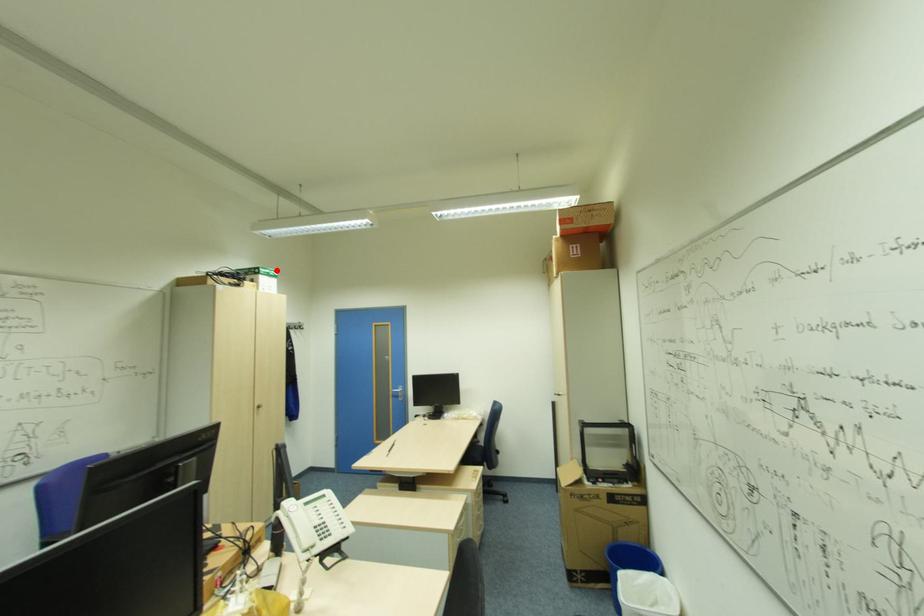
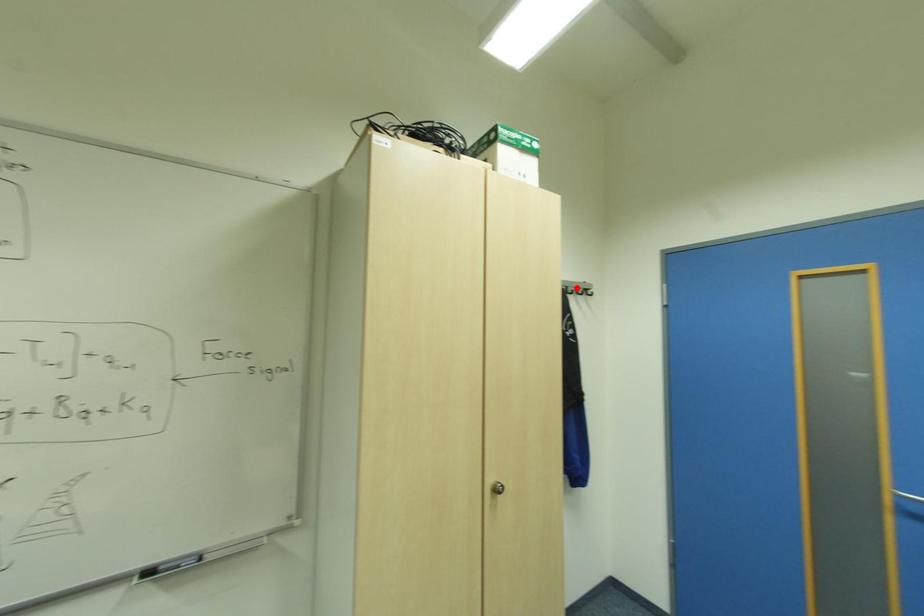
Looking at this image, I am providing you with two images of the same scene from different viewpoints. A red point is marked on the first image and another point is marked on the second image. Is the marked point in image1 the same physical position as the marked point in image2?

No